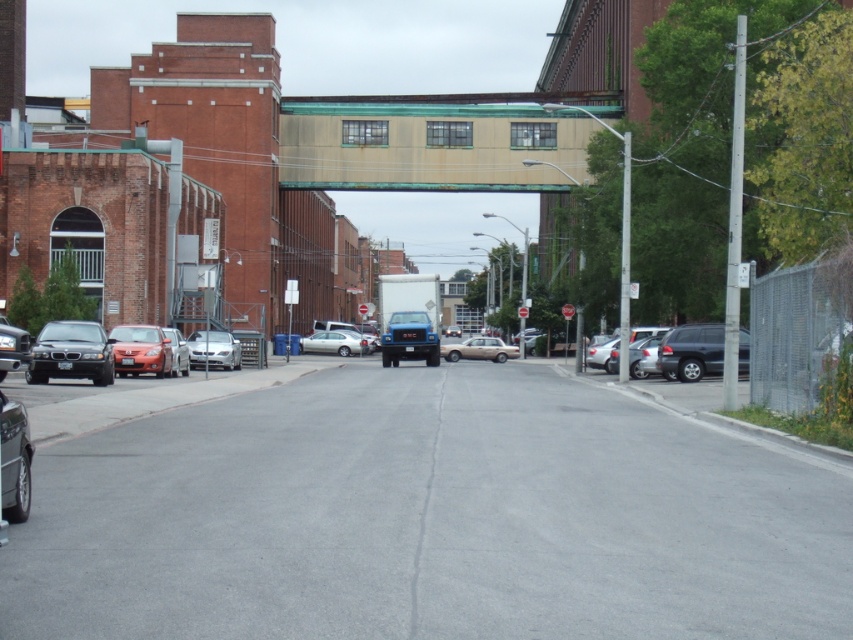
Which is more to the left, matte red car at left or silver metallic sedan at center?

Positioned to the left is matte red car at left.

Is point (135, 333) farther from viewer compared to point (305, 346)?

That is False.

Identify the location of matte red car at left. (142, 349).

From the picture: Can you confirm if satin silver sedan at center-left is taller than matte black car at left?

Yes.

At what (x,y) coordinates should I click in order to perform the action: click on satin silver sedan at center-left. Please return your answer as a coordinate pair (x, y). Looking at the image, I should click on (213, 349).

Does shiny black sedan at left have a smaller size compared to shiny black suv at right?

No, shiny black sedan at left is not smaller than shiny black suv at right.

Does shiny black sedan at left have a greater height compared to shiny black suv at right?

Incorrect, shiny black sedan at left's height is not larger of shiny black suv at right's.

Is point (33, 381) more distant than point (686, 368)?

No.

Identify the location of shiny black sedan at left. This screenshot has width=853, height=640. (71, 353).